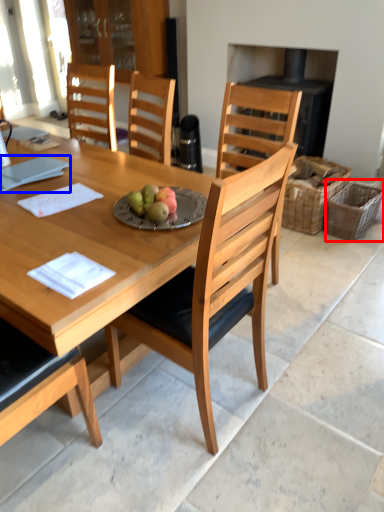
Question: Which point is closer to the camera, picnic basket (highlighted by a red box) or notepad (highlighted by a blue box)?

Choices:
 (A) picnic basket
 (B) notepad

Answer: (B)